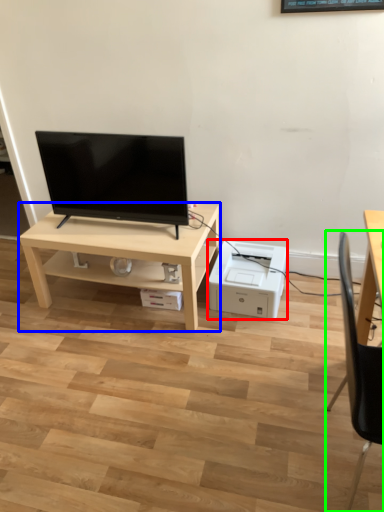
Question: Which is nearer to the printer (highlighted by a red box)? table (highlighted by a blue box) or chair (highlighted by a green box).

Choices:
 (A) table
 (B) chair

Answer: (A)